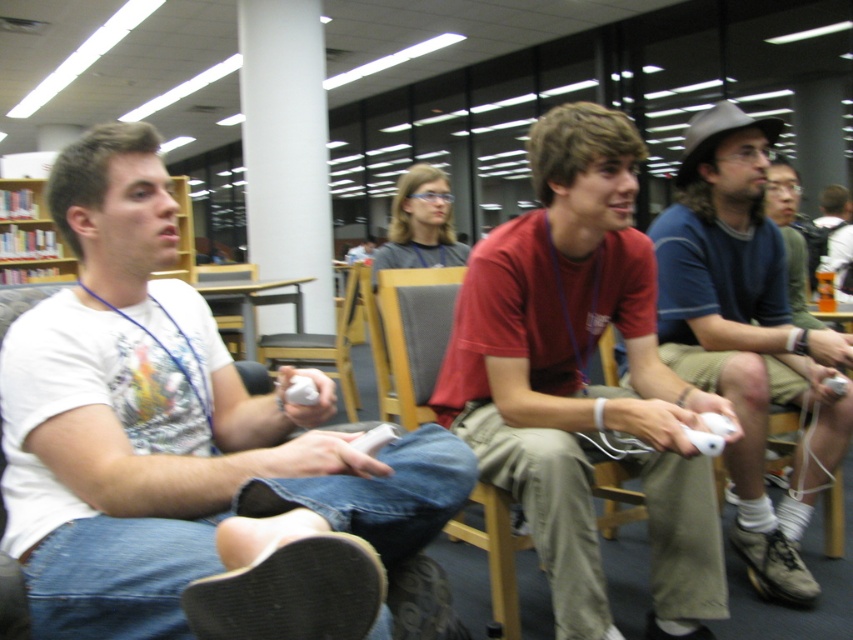
Is matte blue shirt at center to the right of wooden chair at center from the viewer's perspective?

Yes, matte blue shirt at center is to the right of wooden chair at center.

The width and height of the screenshot is (853, 640). Identify the location of matte blue shirt at center. (747, 337).

Locate an element on the screen. The height and width of the screenshot is (640, 853). matte blue shirt at center is located at coordinates (747, 337).

Between point (506, 369) and point (415, 307), which one is positioned behind?

Positioned behind is point (415, 307).

Who is lower down, matte red shirt at center or gray fabric chair at center?

gray fabric chair at center is lower down.

Measure the distance between point (567,355) and camera.

Point (567,355) and camera are 1.79 meters apart from each other.

Identify the location of matte red shirt at center. (581, 378).

Between white matte shirt at left and wooden chair at center, which one appears on the right side from the viewer's perspective?

white matte shirt at left is more to the right.

Can you confirm if white matte shirt at left is thinner than wooden chair at center?

No, white matte shirt at left is not thinner than wooden chair at center.

Between point (10, 538) and point (323, 362), which one is positioned behind?

Positioned behind is point (323, 362).

The height and width of the screenshot is (640, 853). What are the coordinates of `white matte shirt at left` in the screenshot? It's located at (170, 426).